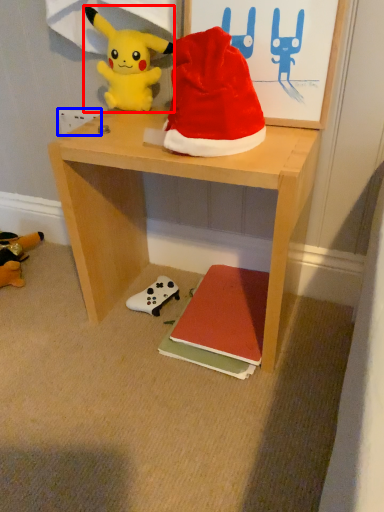
Question: Among these objects, which one is nearest to the camera, toy (highlighted by a red box) or power outlet (highlighted by a blue box)?

Choices:
 (A) toy
 (B) power outlet

Answer: (A)